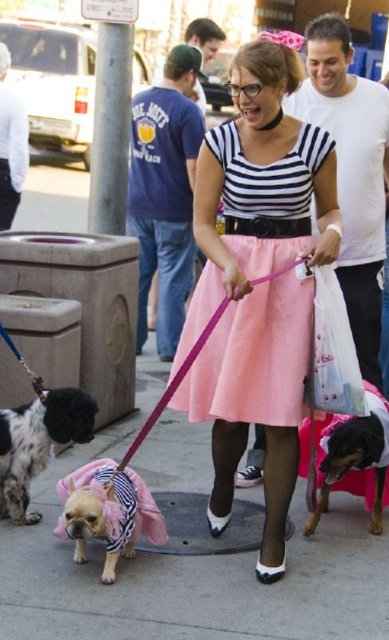
Which of these two, pink fabric dog at center or black and tan dog at center, stands shorter?

Standing shorter between the two is pink fabric dog at center.

Does pink fabric dog at center appear on the right side of black and tan dog at center?

In fact, pink fabric dog at center is to the left of black and tan dog at center.

The image size is (389, 640). Describe the element at coordinates (108, 513) in the screenshot. I see `pink fabric dog at center` at that location.

Where is `pink fabric dog at center`? The height and width of the screenshot is (640, 389). pink fabric dog at center is located at coordinates (108, 513).

Can you confirm if pink satin skirt at center is smaller than black and tan dog at center?

No.

This screenshot has height=640, width=389. Describe the element at coordinates (259, 285) in the screenshot. I see `pink satin skirt at center` at that location.

Is point (257, 205) more distant than point (338, 419)?

No, it is not.

Identify the location of pink satin skirt at center. (259, 285).

Which is above, pink satin skirt at center or pink fabric dog at center?

pink satin skirt at center

Who is lower down, pink satin skirt at center or pink fabric dog at center?

pink fabric dog at center

Between point (306, 355) and point (57, 525), which one is positioned behind?

Point (57, 525)

The image size is (389, 640). Find the location of `pink satin skirt at center`. pink satin skirt at center is located at coordinates (259, 285).